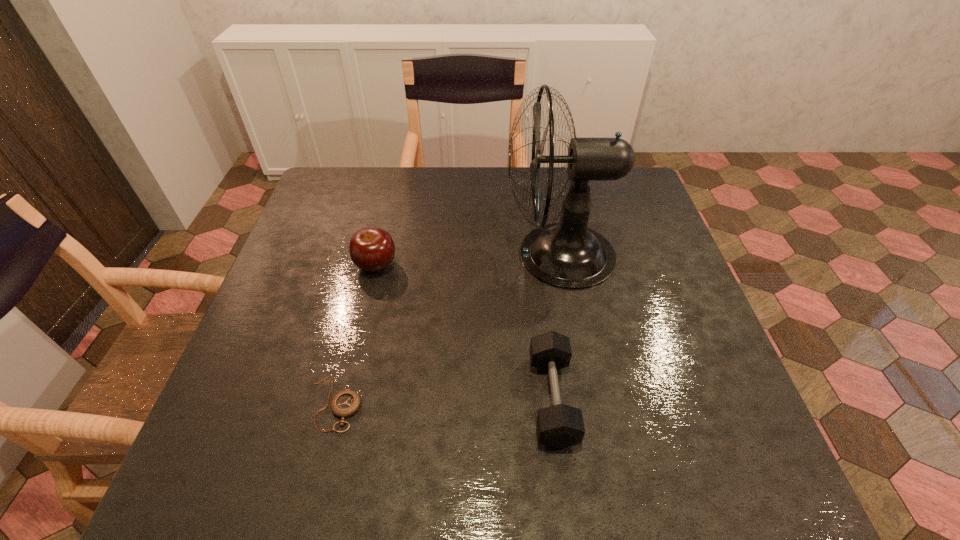
Where is `vacant space that satisfies the following two spatial constraints: 1. on the front-facing side of the tallest object; 2. on the front side of the shortest object`? The height and width of the screenshot is (540, 960). vacant space that satisfies the following two spatial constraints: 1. on the front-facing side of the tallest object; 2. on the front side of the shortest object is located at coordinates (587, 404).

The width and height of the screenshot is (960, 540). What are the coordinates of `free location that satisfies the following two spatial constraints: 1. on the front side of the third tallest object; 2. on the left side of the second tallest object` in the screenshot? It's located at (345, 399).